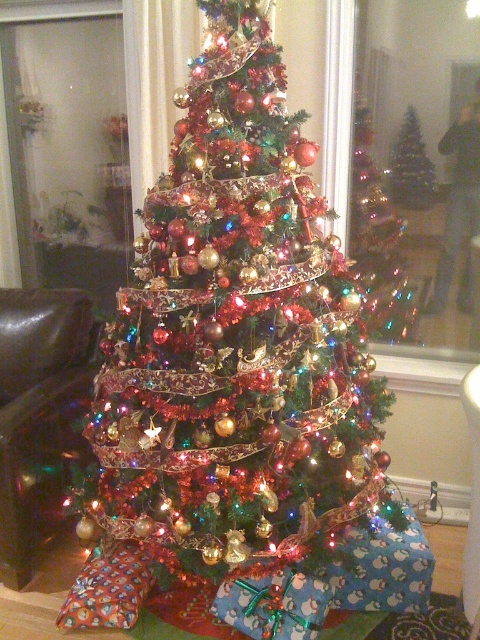
You are standing in front of the Christmas tree and notice a specific point marked at coordinates (236, 339). Based on the scene description, can you identify what object or feature is located at this coordinate?

The point at coordinates (236, 339) corresponds to the shiny metallic Christmas tree at center, as indicated in the objects description.

You are planning to place a large star ornament on top of the tree. Which tree should you choose between the shiny metallic christmas tree at center and the shiny silver christmas tree at center if you want the star to be more visible from the entrance?

The shiny metallic christmas tree at center has a larger size compared to the shiny silver christmas tree at center, so placing the star on top of the shiny metallic christmas tree at center will make it more visible from the entrance.